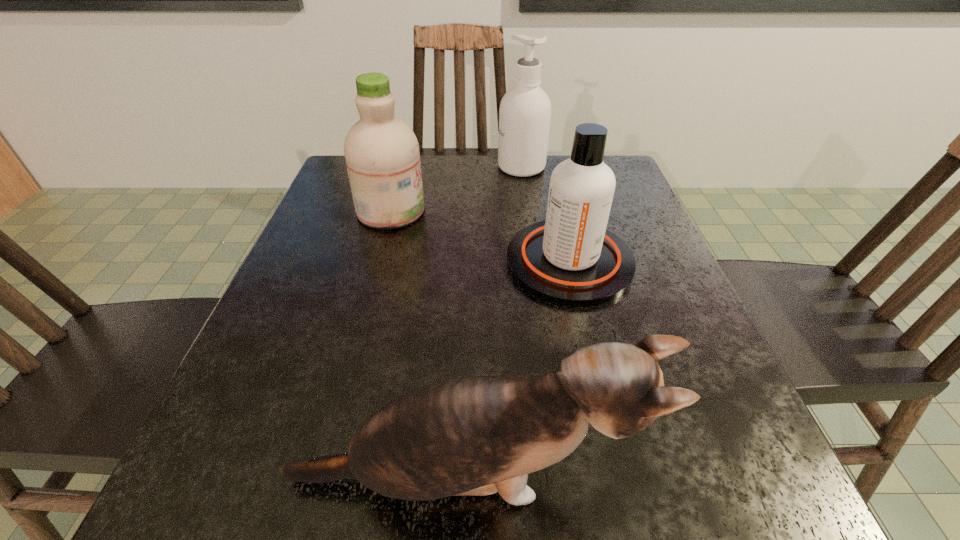
At what (x,y) coordinates should I click in order to perform the action: click on free point between the leftmost cleansing agent and the farthest object. Please return your answer as a coordinate pair (x, y). This screenshot has height=540, width=960. Looking at the image, I should click on (456, 189).

In order to click on vacant area that lies between the farthest object and the nearest object in this screenshot , I will do `click(492, 323)`.

Where is `object that can be found as the closest to the leftmost cleansing agent`? object that can be found as the closest to the leftmost cleansing agent is located at coordinates (571, 259).

Locate an element on the screen. The width and height of the screenshot is (960, 540). the second closest object to the farthest object is located at coordinates (571, 259).

Find the location of a particular element. The height and width of the screenshot is (540, 960). cleansing agent object that ranks as the second closest to the leftmost cleansing agent is located at coordinates (525, 110).

You are a GUI agent. You are given a task and a screenshot of the screen. Output one action in this format:
    pyautogui.click(x=<x>, y=<y>)
    Task: Click on the cleansing agent that stands as the closest to the cat
    The height and width of the screenshot is (540, 960).
    Given the screenshot: What is the action you would take?
    pyautogui.click(x=571, y=259)